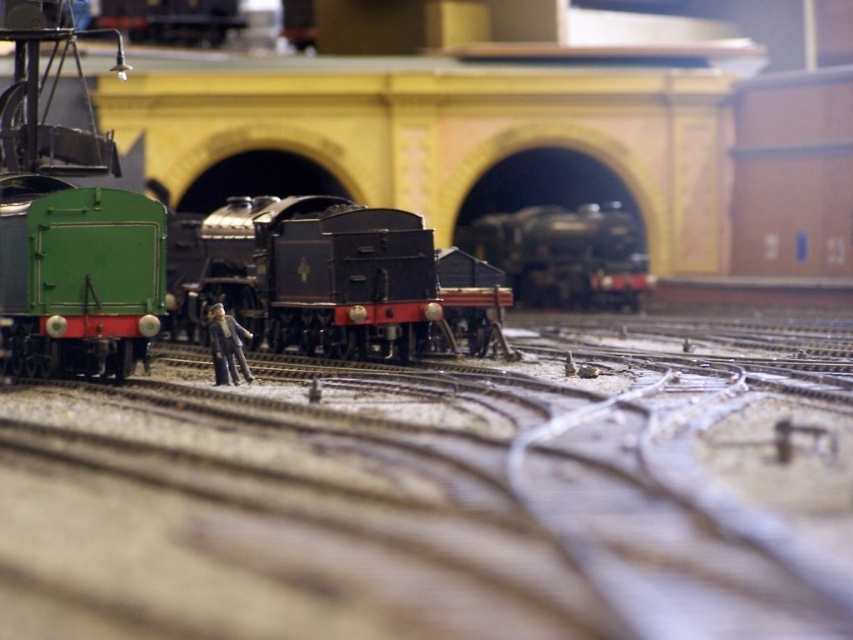
Question: Which point is farther to the camera?

Choices:
 (A) polished black locomotive at center
 (B) brown gravel train track at center
 (C) smooth gray figure at center
 (D) shiny black locomotive at center

Answer: (D)

Question: Does polished black locomotive at center have a lesser width compared to shiny black locomotive at center?

Choices:
 (A) no
 (B) yes

Answer: (A)

Question: Considering the real-world distances, which object is farthest from the brown gravel train track at center?

Choices:
 (A) shiny black locomotive at center
 (B) smooth gray figure at center

Answer: (A)

Question: Can you confirm if polished black locomotive at center is smaller than smooth gray figure at center?

Choices:
 (A) no
 (B) yes

Answer: (A)

Question: Based on their relative distances, which object is nearer to the shiny black locomotive at center?

Choices:
 (A) brown gravel train track at center
 (B) smooth gray figure at center

Answer: (A)

Question: Is the position of polished black locomotive at center less distant than that of smooth gray figure at center?

Choices:
 (A) yes
 (B) no

Answer: (B)